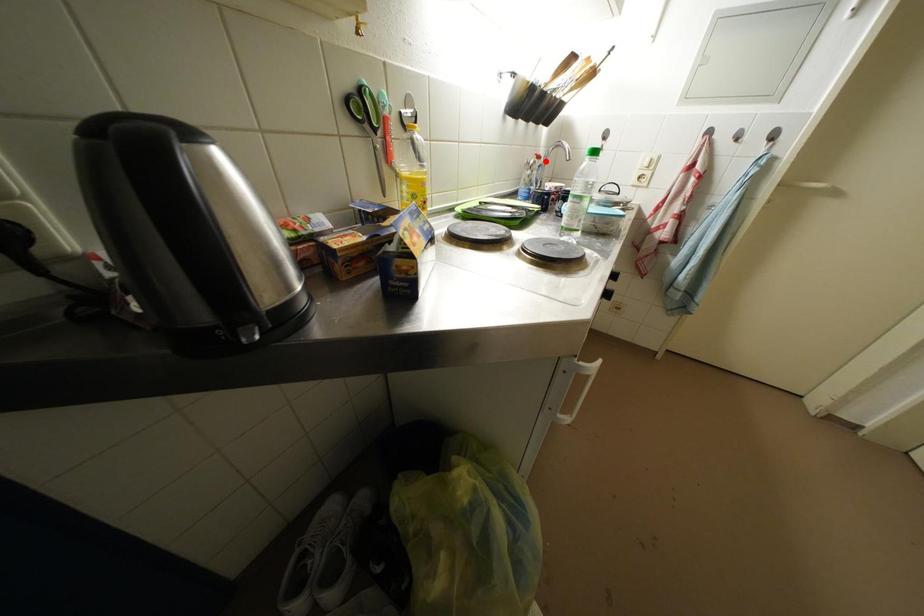
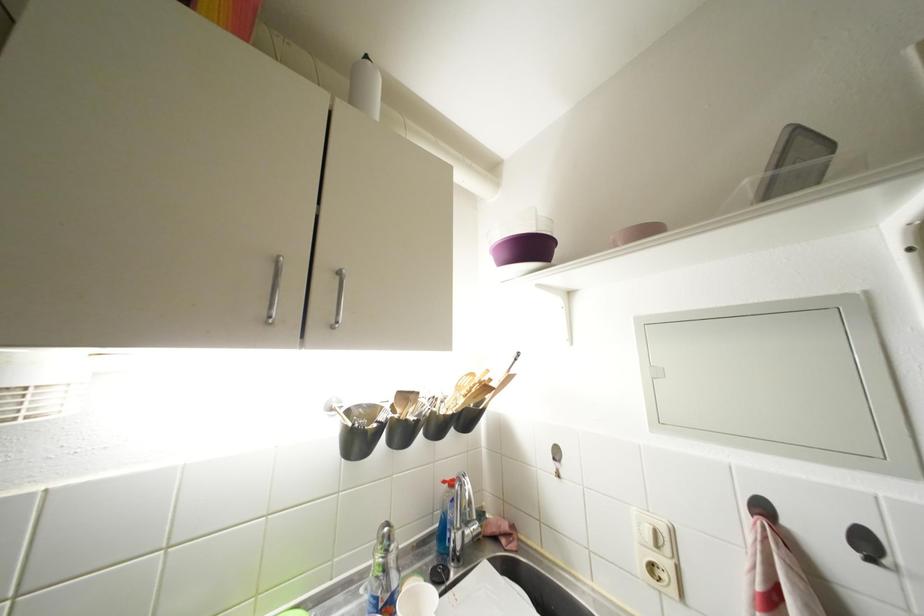
Find the pixel in the second image that matches the highlighted location in the first image.

(457, 488)